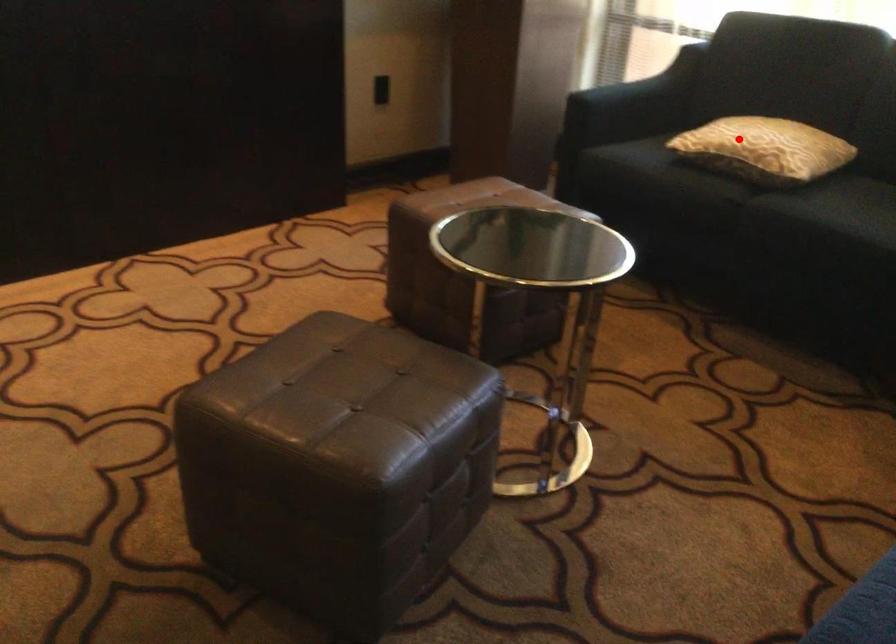
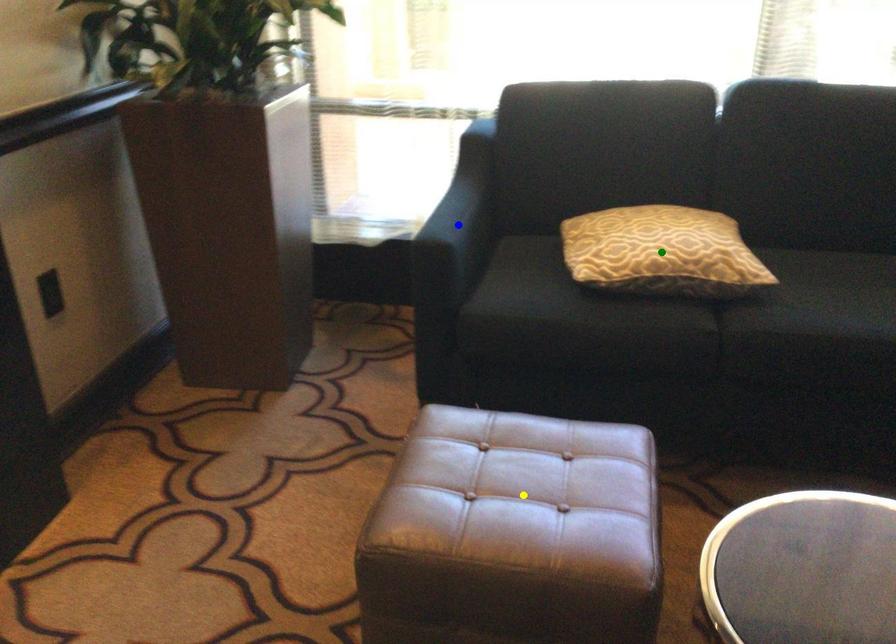
Question: I am providing you with two images of the same scene from different viewpoints. A red point is marked on the first image. You are given multiple points on the second image. Which mark in image 2 goes with the point in image 1?

Choices:
 (A) green point
 (B) yellow point
 (C) blue point

Answer: (A)